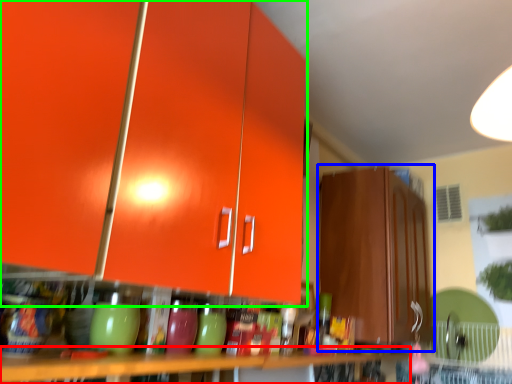
Question: Considering the real-world distances, which object is farthest from table (highlighted by a red box)? cabinetry (highlighted by a blue box) or cabinetry (highlighted by a green box)?

Choices:
 (A) cabinetry
 (B) cabinetry

Answer: (A)